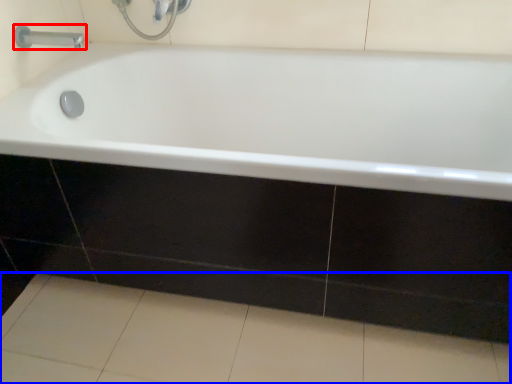
Question: Which object appears farthest to the camera in this image, tap (highlighted by a red box) or ceramic tile (highlighted by a blue box)?

Choices:
 (A) tap
 (B) ceramic tile

Answer: (A)